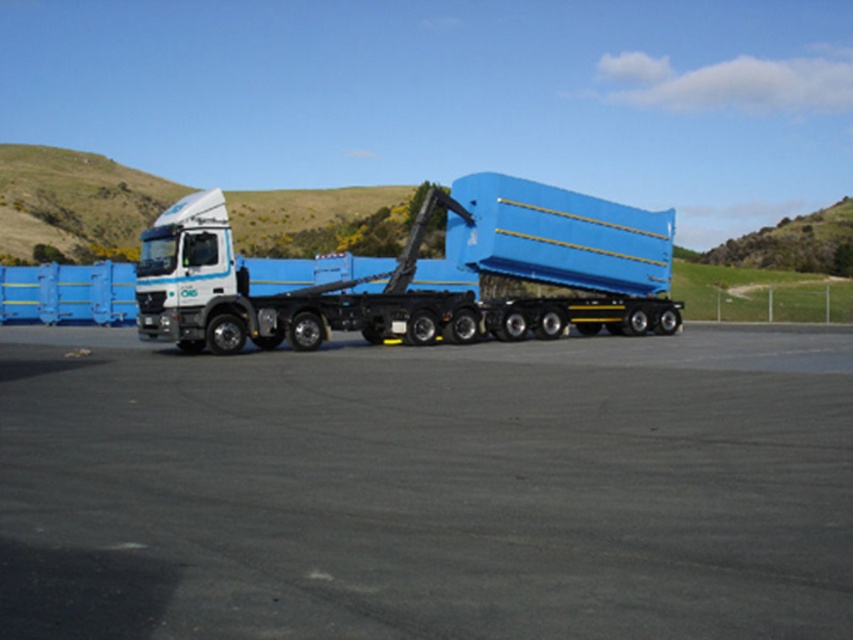
Does black asphalt at center appear under matte blue truck at center?

Yes, black asphalt at center is below matte blue truck at center.

Between black asphalt at center and matte blue truck at center, which one has less height?

With less height is black asphalt at center.

Image resolution: width=853 pixels, height=640 pixels. Describe the element at coordinates (428, 490) in the screenshot. I see `black asphalt at center` at that location.

The width and height of the screenshot is (853, 640). I want to click on black asphalt at center, so click(x=428, y=490).